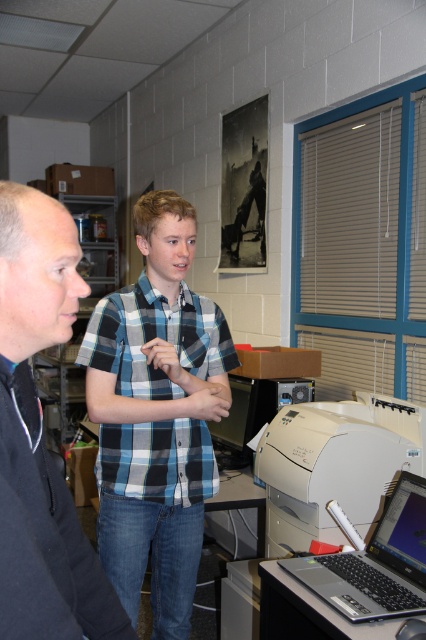
Question: Estimate the real-world distances between objects in this image. Which object is closer to the black plastic printer at center?

Choices:
 (A) dark blue sweater at left
 (B) white matte printer at lower right

Answer: (B)

Question: Among these points, which one is farthest from the camera?

Choices:
 (A) 213,426
 (B) 400,540
 (C) 377,547
 (D) 34,604

Answer: (A)

Question: Where is blue plaid shirt at center located in relation to satin silver laptop at lower right in the image?

Choices:
 (A) left
 (B) right

Answer: (A)

Question: Which point is farther to the camera?

Choices:
 (A) black plastic printer at center
 (B) blue plaid shirt at center

Answer: (A)

Question: Does satin silver laptop at lower right have a larger size compared to shiny black laptop at lower right?

Choices:
 (A) yes
 (B) no

Answer: (A)

Question: Is blue plaid shirt at center thinner than black plastic printer at center?

Choices:
 (A) no
 (B) yes

Answer: (B)